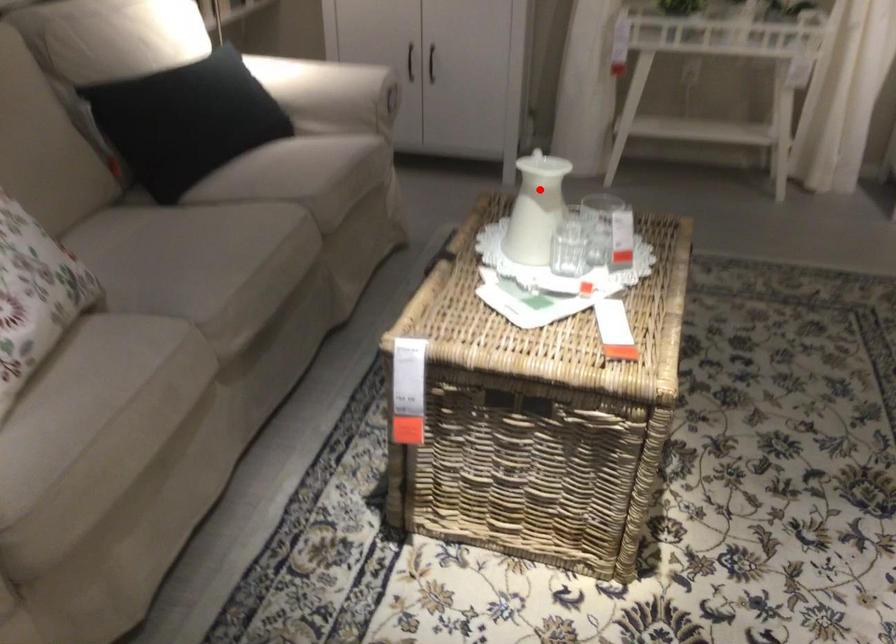
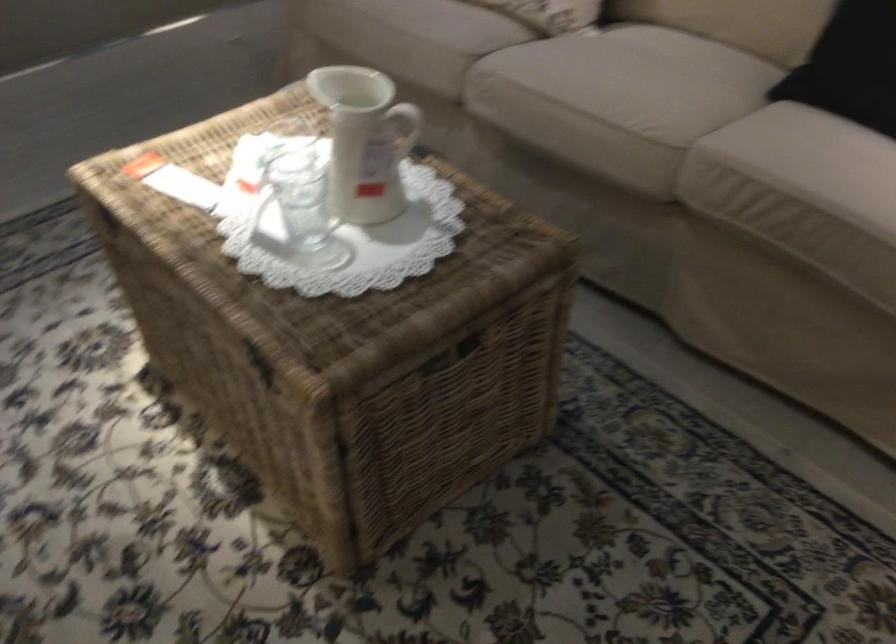
Question: A red point is marked in image1. In image2, is the corresponding 3D point closer to the camera or farther? Reply with the corresponding letter.

Choices:
 (A) The corresponding 3D point is closer.
 (B) The corresponding 3D point is farther.

Answer: (A)